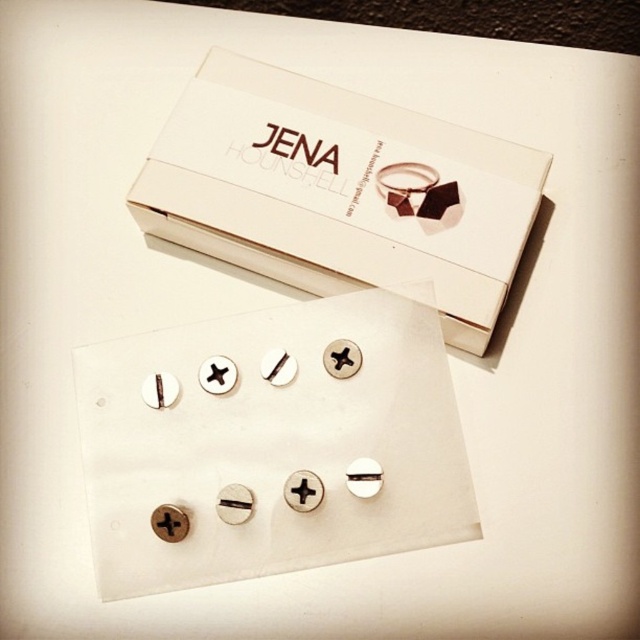
Question: In this image, where is silver metallic screws at center located relative to white cardboard box at upper center?

Choices:
 (A) below
 (B) above

Answer: (A)

Question: Can you confirm if silver metallic screws at center is wider than white cardboard box at upper center?

Choices:
 (A) no
 (B) yes

Answer: (A)

Question: Does silver metallic screws at center have a larger size compared to white cardboard box at upper center?

Choices:
 (A) no
 (B) yes

Answer: (B)

Question: Which object is closer to the camera taking this photo?

Choices:
 (A) silver metallic screws at center
 (B) white cardboard box at upper center

Answer: (A)

Question: Which point is farther to the camera?

Choices:
 (A) (106, 369)
 (B) (342, 204)

Answer: (B)

Question: Among these objects, which one is farthest from the camera?

Choices:
 (A) silver metallic screws at center
 (B) white cardboard box at upper center

Answer: (B)